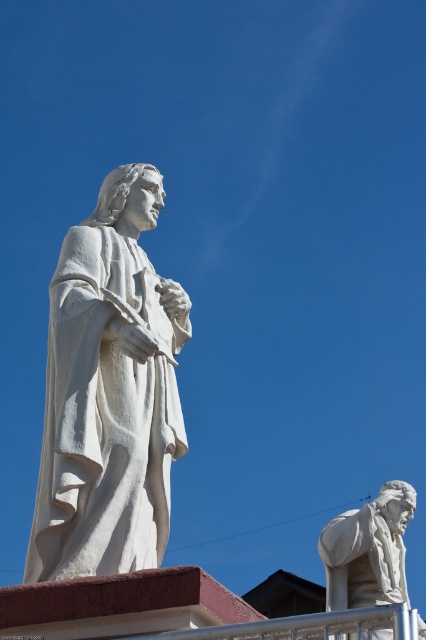
Who is shorter, white marble statue at left or white marble statue at lower right?

Standing shorter between the two is white marble statue at lower right.

Between point (83, 330) and point (348, 577), which one is positioned in front?

Point (83, 330)

You are a GUI agent. You are given a task and a screenshot of the screen. Output one action in this format:
    pyautogui.click(x=<x>, y=<y>)
    Task: Click on the white marble statue at left
    The height and width of the screenshot is (640, 426).
    Given the screenshot: What is the action you would take?
    pyautogui.click(x=109, y=392)